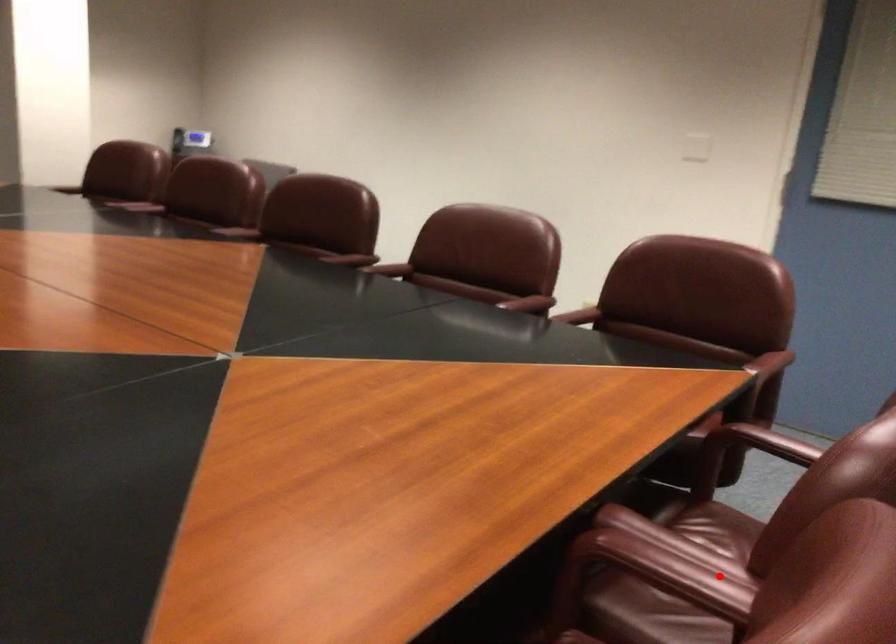
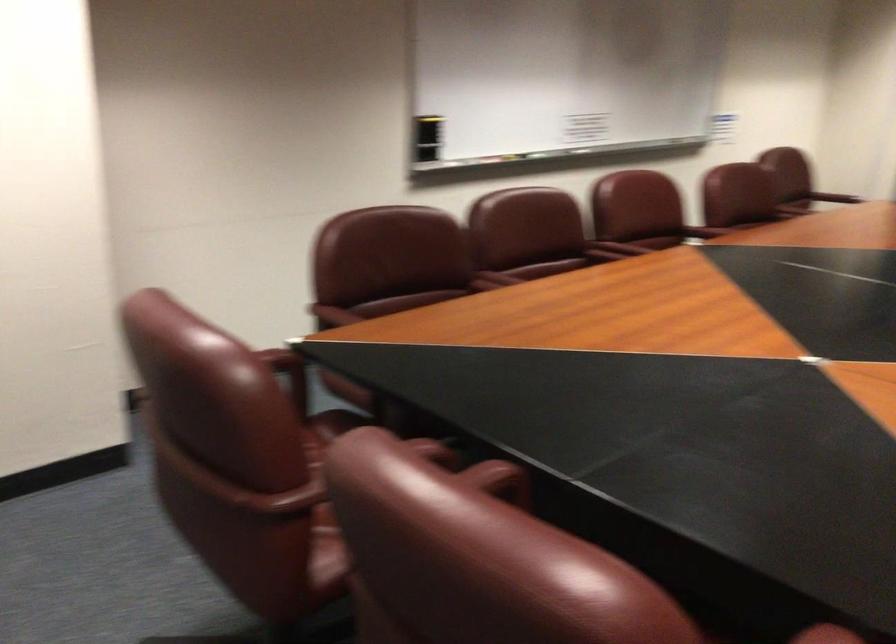
Find the pixel in the second image that matches the highlighted location in the first image.

(497, 277)